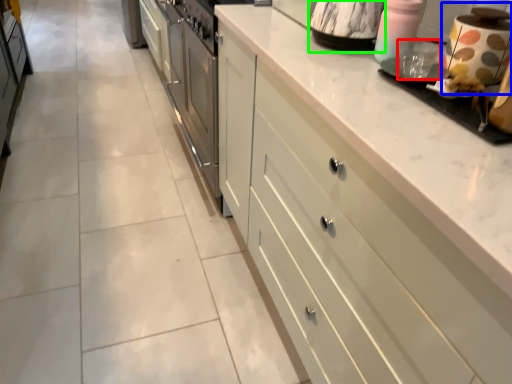
Question: Which object is positioned closest to appliance (highlighted by a red box)? Select from appliance (highlighted by a blue box) and appliance (highlighted by a green box).

Choices:
 (A) appliance
 (B) appliance

Answer: (A)